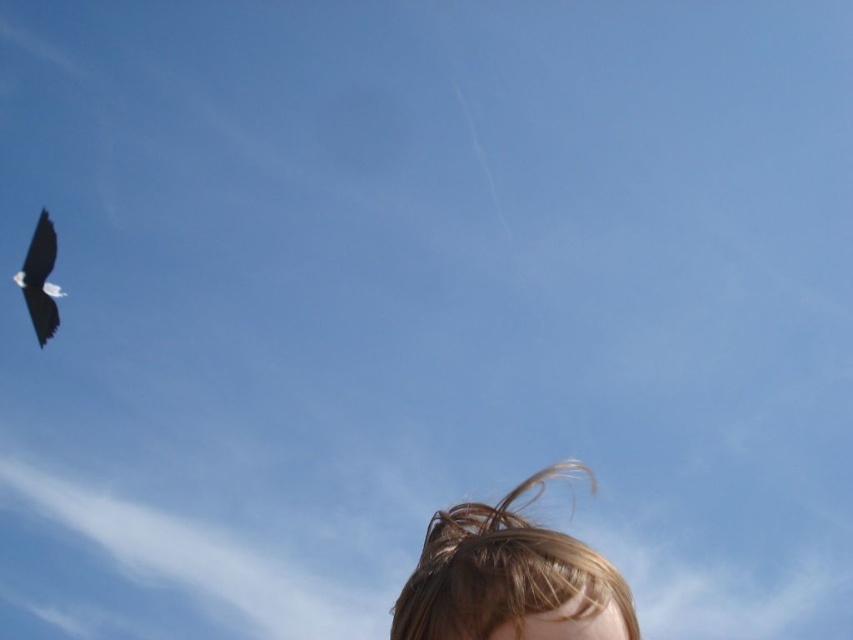
You are a photographer aiming to capture a picture of the black glossy bird at upper left while avoiding the blonde hair at lower center. Based on their positions, can you position yourself so that the bird is in the frame without the hair obstructing it?

Yes, since the blonde hair at lower center is located below the black glossy bird at upper left, you can position yourself to frame the shot so that the bird appears above the hair, ensuring it is visible without obstruction.

You are a photographer trying to capture a photo of the black glossy bird at upper left and the blonde hair at lower center. Which object should you focus on first to ensure both are in sharp focus?

You should focus on the blonde hair at lower center first since it is closer to the viewer than the black glossy bird at upper left, ensuring both will be in focus when using a shallow depth of field.